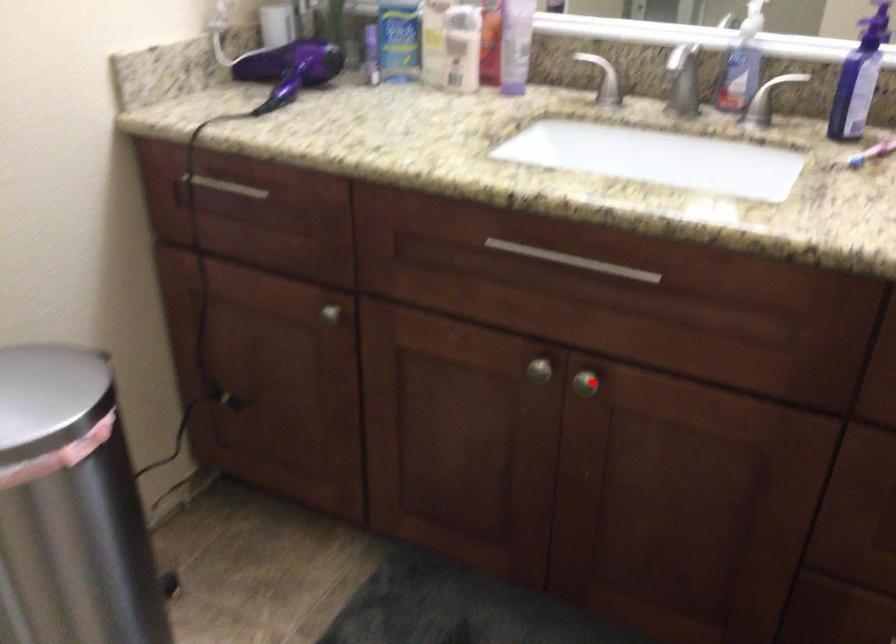
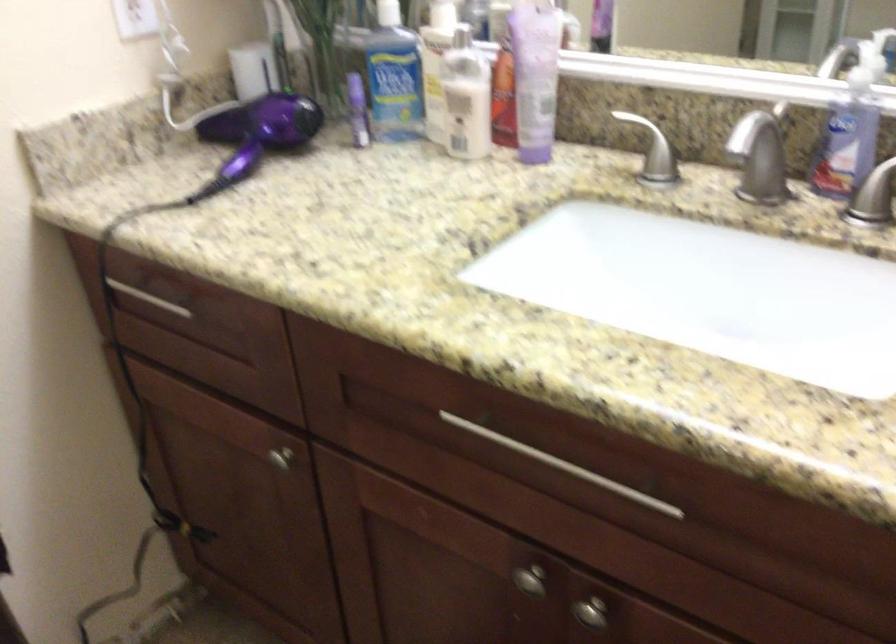
Find the pixel in the second image that matches the highlighted location in the first image.

(590, 612)